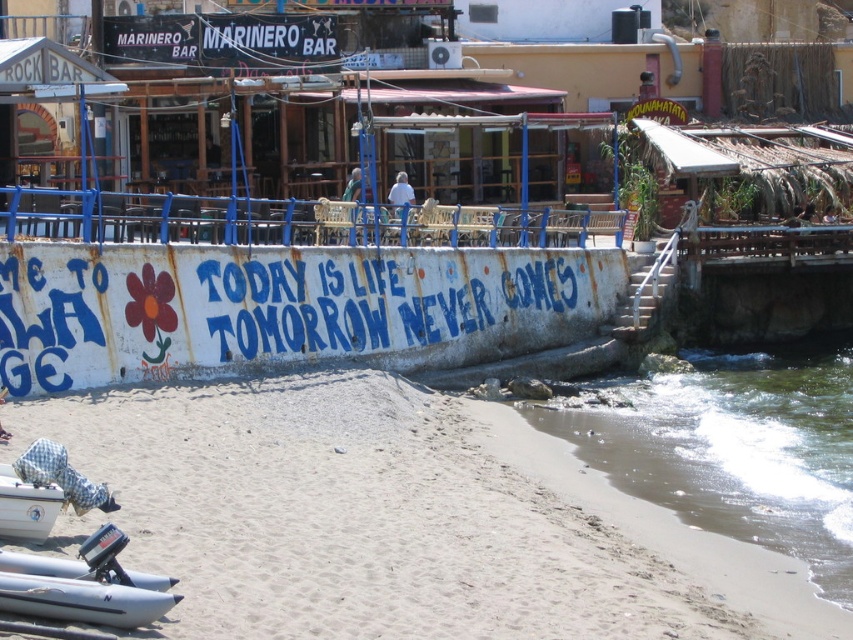
You are standing on the beach and want to take a photo of the clear water at lower right. Where should you position yourself to capture it in the lower right corner of your camera frame?

Position yourself so that the clear water at lower right is aligned with the lower right corner of your camera frame, as its 2D coordinates are at point (732, 448).

You are standing at the center of the image. Which direction should you move to reach the white sandy beach at lower left?

You should move to the lower left direction to reach the white sandy beach at lower left as it is located at point (352, 516).

You are standing on the white sandy beach at lower left and want to reach the white rubber boat at lower left. Which direction should you move to get closer to the boat?

Since the white sandy beach at lower left is further to the viewer than the white rubber boat at lower left, you should move backward to get closer to the boat.